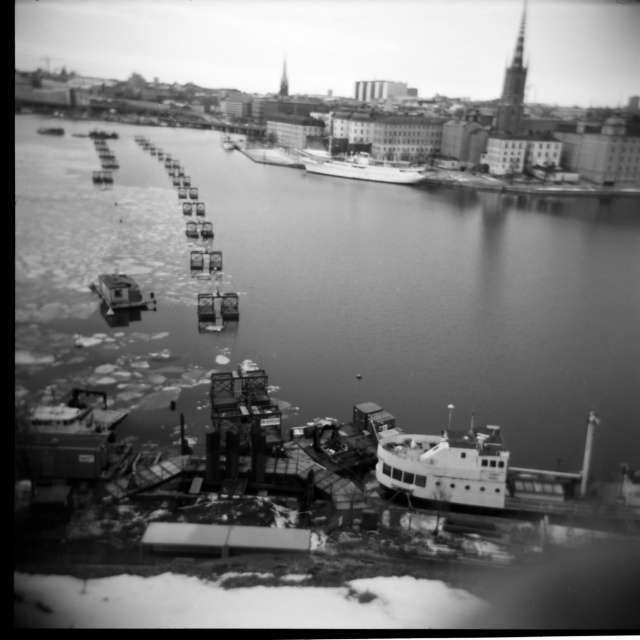
Is white matte boat at lower right smaller than white matte boat at center?

Correct, white matte boat at lower right occupies less space than white matte boat at center.

Is point (492, 442) positioned after point (333, 170)?

No, it is in front of (333, 170).

The image size is (640, 640). In order to click on white matte boat at lower right in this screenshot , I will do `click(445, 467)`.

Does point (497, 448) lie in front of point (108, 310)?

Yes, point (497, 448) is in front of point (108, 310).

Find the location of a particular element. The image size is (640, 640). white matte boat at lower right is located at coordinates (445, 467).

Can you confirm if metallic gray boat at lower left is shorter than smooth white ship at center?

Correct, metallic gray boat at lower left is not as tall as smooth white ship at center.

Can you confirm if metallic gray boat at lower left is smaller than smooth white ship at center?

Indeed, metallic gray boat at lower left has a smaller size compared to smooth white ship at center.

Is point (132, 280) positioned before point (289, 164)?

Yes, it is.

Where is `metallic gray boat at lower left`? The height and width of the screenshot is (640, 640). metallic gray boat at lower left is located at coordinates (118, 292).